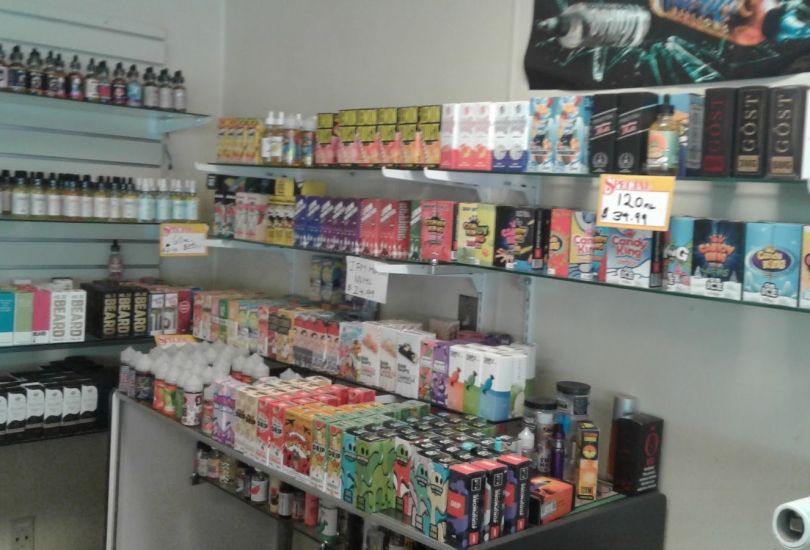
You are a GUI agent. You are given a task and a screenshot of the screen. Output one action in this format:
    pyautogui.click(x=<x>, y=<y>)
    Task: Click on the shelf support
    This screenshot has height=550, width=810.
    Given the screenshot: What is the action you would take?
    pyautogui.click(x=467, y=184), pyautogui.click(x=399, y=174), pyautogui.click(x=241, y=170), pyautogui.click(x=177, y=122), pyautogui.click(x=226, y=242), pyautogui.click(x=403, y=271)